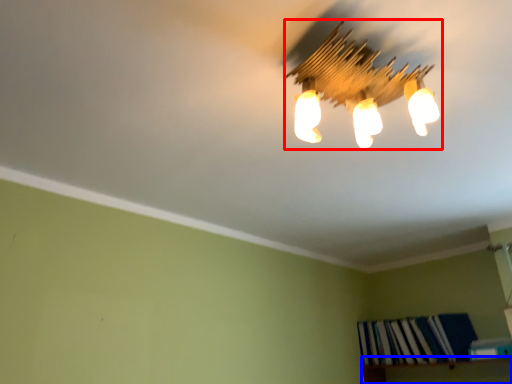
Question: Which object appears closest to the camera in this image, lamp (highlighted by a red box) or shelf (highlighted by a blue box)?

Choices:
 (A) lamp
 (B) shelf

Answer: (A)